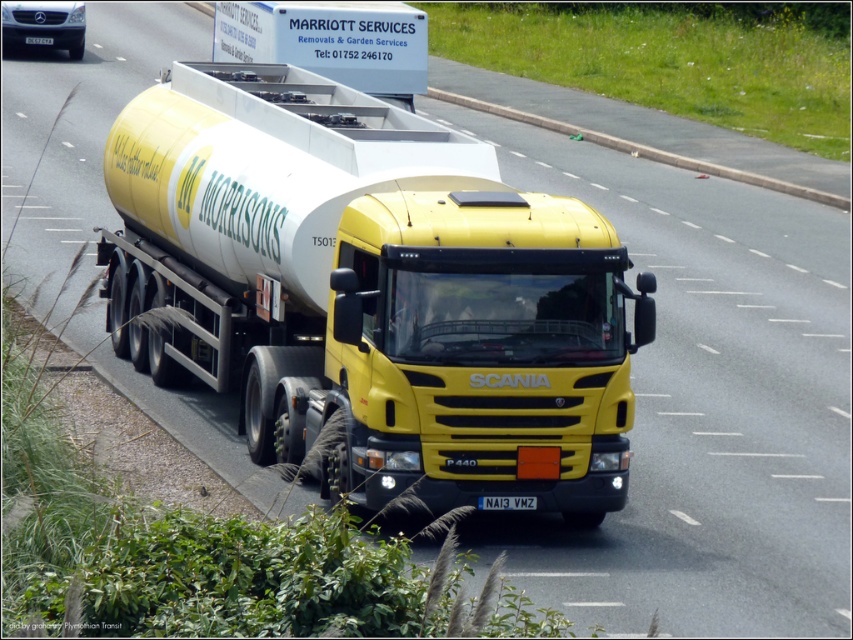
Question: Considering the relative positions of yellow matte trailer truck at center and white plastic license plate at center in the image provided, where is yellow matte trailer truck at center located with respect to white plastic license plate at center?

Choices:
 (A) left
 (B) right

Answer: (A)

Question: Can you confirm if yellow matte trailer truck at center is bigger than white plastic license plate at center?

Choices:
 (A) yes
 (B) no

Answer: (A)

Question: Which object appears closest to the camera in this image?

Choices:
 (A) white plastic license plate at center
 (B) yellow matte trailer truck at center

Answer: (A)

Question: Does yellow matte trailer truck at center appear on the left side of white plastic license plate at center?

Choices:
 (A) yes
 (B) no

Answer: (A)